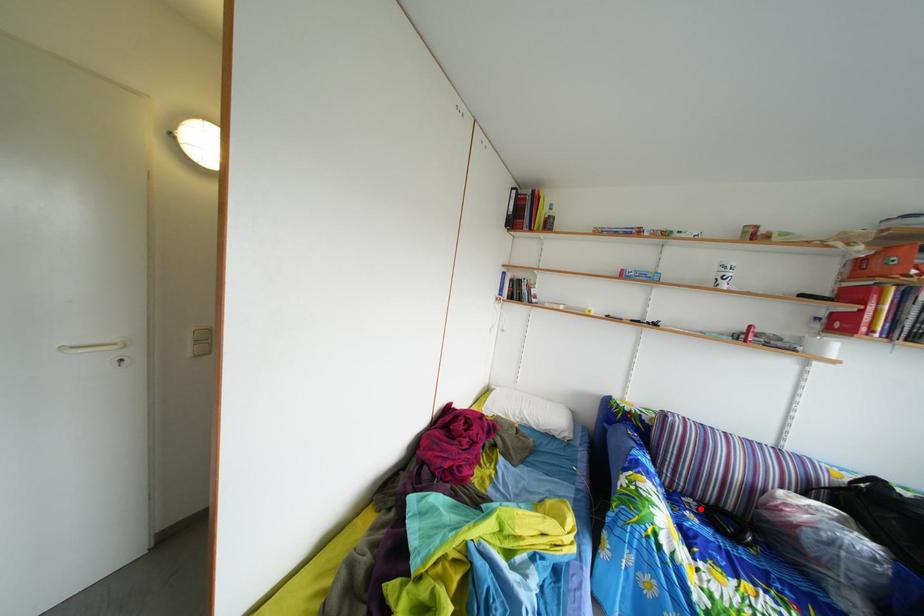
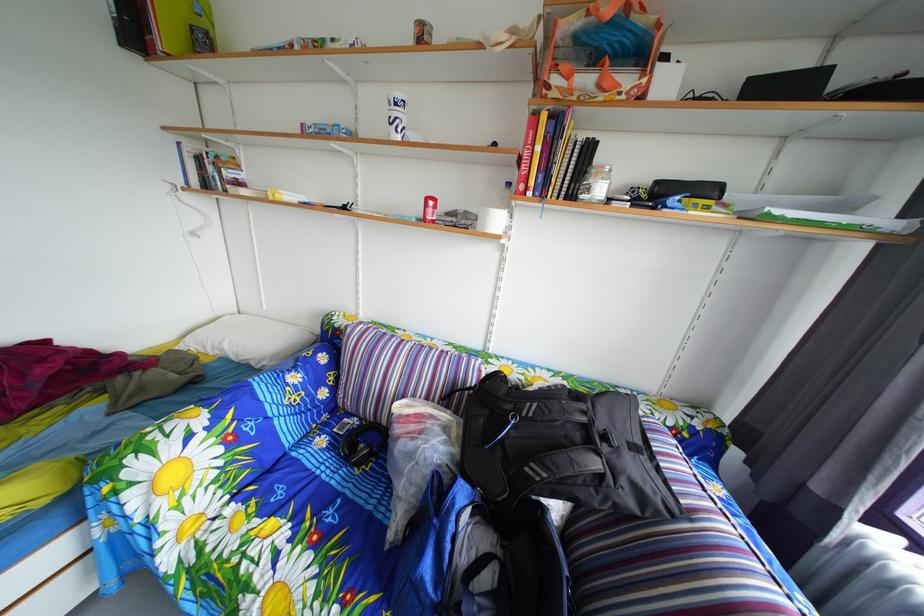
Where in the second image is the point corresponding to the highlighted location from the first image?

(367, 428)